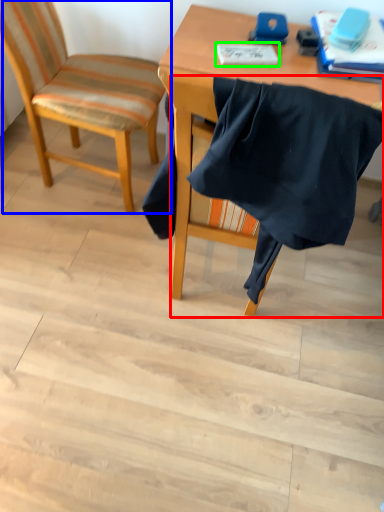
Question: Which object is positioned closest to chair (highlighted by a red box)? Select from chair (highlighted by a blue box) and notebook (highlighted by a green box).

Choices:
 (A) chair
 (B) notebook

Answer: (B)